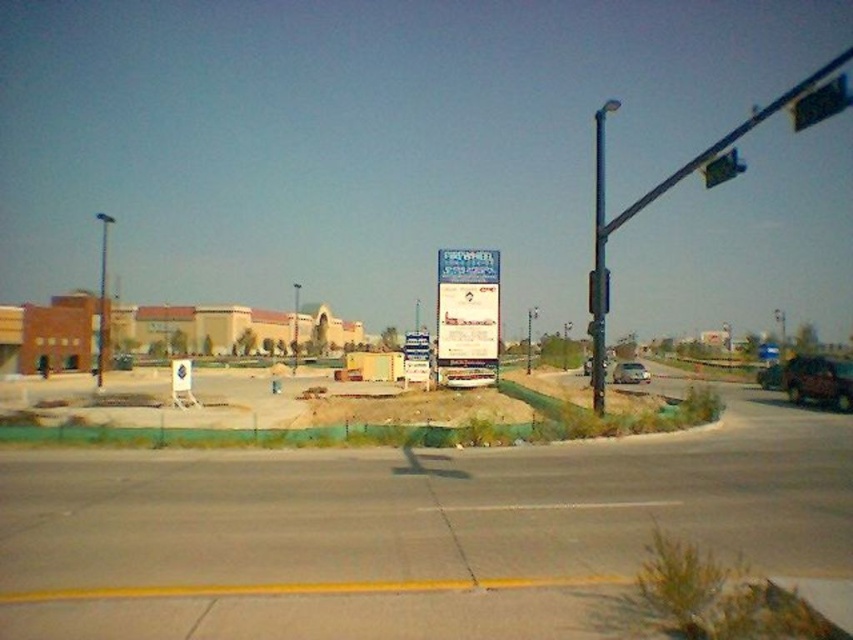
Question: Is metallic red suv at right below silver metallic sedan at center?

Choices:
 (A) yes
 (B) no

Answer: (B)

Question: Where is metallic pole at center-right located in relation to metallic red suv at right in the image?

Choices:
 (A) above
 (B) below

Answer: (A)

Question: Which of the following is the farthest from the observer?

Choices:
 (A) (787, 374)
 (B) (585, 360)

Answer: (B)

Question: Which of these objects is positioned closest to the metallic pole at center?

Choices:
 (A) silver metallic sedan at center
 (B) metallic pole at center-right
 (C) metallic silver sedan at center

Answer: (A)

Question: Estimate the real-world distances between objects in this image. Which object is farther from the metallic red suv at right?

Choices:
 (A) metallic pole at center-right
 (B) metallic pole at center
 (C) green metallic pole at center

Answer: (B)

Question: In this image, where is green glass traffic light at upper right located relative to metallic silver sedan at center?

Choices:
 (A) above
 (B) below

Answer: (A)